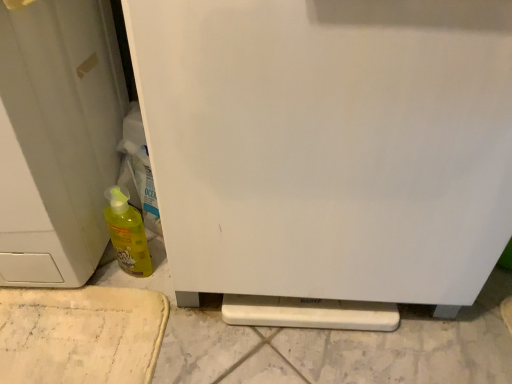
Question: Can you confirm if yellow translucent bottle at lower left is smaller than white matte door at left?

Choices:
 (A) no
 (B) yes

Answer: (B)

Question: From a real-world perspective, is yellow translucent bottle at lower left beneath white matte door at left?

Choices:
 (A) yes
 (B) no

Answer: (A)

Question: Considering the relative sizes of yellow translucent bottle at lower left and white matte door at left in the image provided, is yellow translucent bottle at lower left bigger than white matte door at left?

Choices:
 (A) yes
 (B) no

Answer: (B)

Question: Is yellow translucent bottle at lower left further to camera compared to white matte door at left?

Choices:
 (A) no
 (B) yes

Answer: (B)

Question: Can you confirm if yellow translucent bottle at lower left is taller than white matte door at left?

Choices:
 (A) yes
 (B) no

Answer: (B)

Question: From the image's perspective, relative to white matte door at left, is yellow translucent bottle at lower left above or below?

Choices:
 (A) below
 (B) above

Answer: (A)

Question: Considering the positions of yellow translucent bottle at lower left and white matte door at left in the image, is yellow translucent bottle at lower left bigger or smaller than white matte door at left?

Choices:
 (A) small
 (B) big

Answer: (A)

Question: Is yellow translucent bottle at lower left in front of or behind white matte door at left in the image?

Choices:
 (A) behind
 (B) front

Answer: (A)

Question: Is yellow translucent bottle at lower left wider or thinner than white matte door at left?

Choices:
 (A) wide
 (B) thin

Answer: (B)

Question: Is white matte refrigerator at center to the left or to the right of yellow translucent bottle at lower left in the image?

Choices:
 (A) right
 (B) left

Answer: (A)

Question: From a real-world perspective, is white matte refrigerator at center physically located above or below yellow translucent bottle at lower left?

Choices:
 (A) above
 (B) below

Answer: (A)

Question: From the image's perspective, relative to yellow translucent bottle at lower left, is white matte refrigerator at center above or below?

Choices:
 (A) above
 (B) below

Answer: (A)

Question: Is point (290, 6) closer or farther from the camera than point (122, 193)?

Choices:
 (A) farther
 (B) closer

Answer: (B)

Question: Is point (390, 236) positioned closer to the camera than point (29, 92)?

Choices:
 (A) farther
 (B) closer

Answer: (A)

Question: Looking at their shapes, would you say white matte refrigerator at center is wider or thinner than white matte door at left?

Choices:
 (A) wide
 (B) thin

Answer: (B)